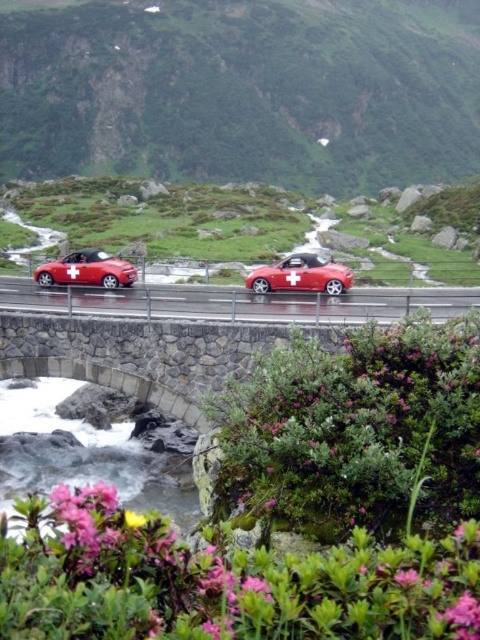
You are a photographer positioned at the stone bridge aiming to capture both the red matte car at center and the shiny red convertible at left in the same frame. Based on their positions, which car should you adjust your camera angle to include first?

The shiny red convertible at left is positioned to the left of the red matte car at center, so you should adjust your camera angle to include the shiny red convertible at left first to ensure both cars are in the frame.

You are a drone operator trying to capture a photo of the smooth yellow flower at lower left and the white smooth water at center. Which object should you focus on first if you want to ensure both are in the same frame without moving the drone?

You should focus on the white smooth water at center first because it might be wider than the smooth yellow flower at lower left, so centering it would allow the flower to fit into the frame more easily.

You are a drone operator trying to capture a photo of the white smooth water at center. The drone is currently at the point marked by point (84, 454). Can you confirm if the drone is positioned directly above the white smooth water at center?

The white smooth water at center is represented by point (84, 454), so yes, the drone is positioned directly above the white smooth water at center.